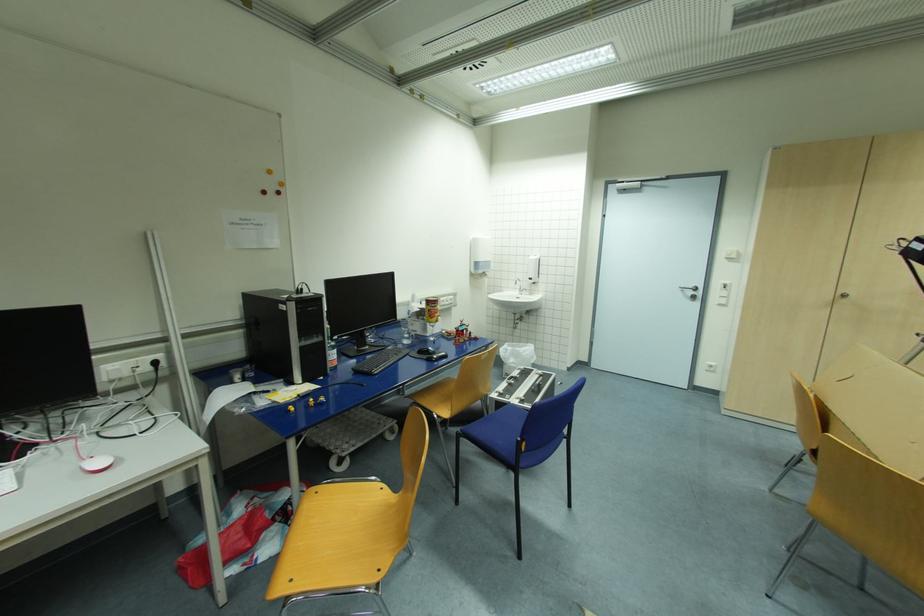
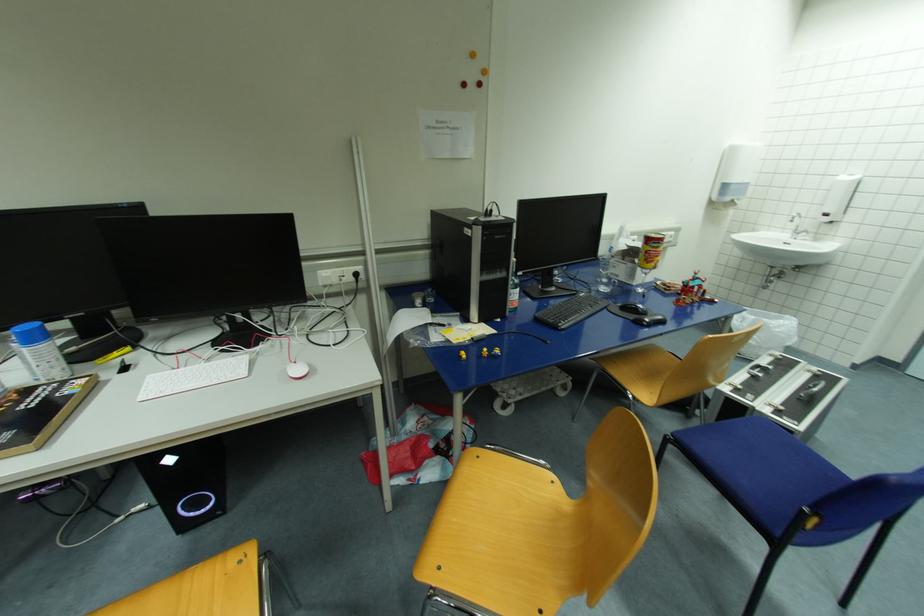
The point at (324, 399) is marked in the first image. Where is the corresponding point in the second image?

(500, 352)